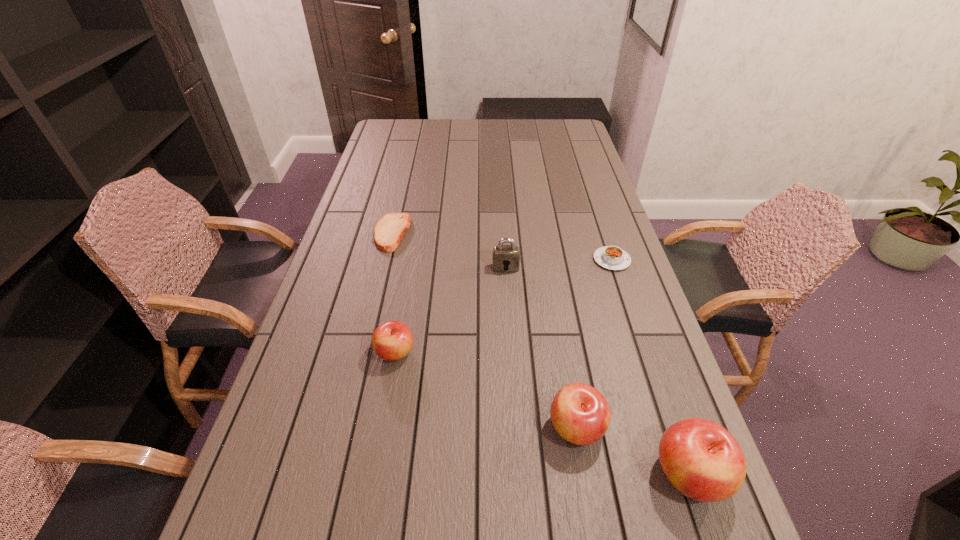
At what (x,y) coordinates should I click in order to perform the action: click on the farthest apple. Please return your answer as a coordinate pair (x, y). Looking at the image, I should click on (393, 340).

Image resolution: width=960 pixels, height=540 pixels. Find the location of `the leftmost apple`. the leftmost apple is located at coordinates (393, 340).

This screenshot has width=960, height=540. I want to click on the second apple from left to right, so click(580, 414).

Where is `the second tallest apple`? This screenshot has height=540, width=960. the second tallest apple is located at coordinates (580, 414).

Where is `the tallest object`? The image size is (960, 540). the tallest object is located at coordinates (701, 459).

Image resolution: width=960 pixels, height=540 pixels. I want to click on the rightmost apple, so 701,459.

Locate an element on the screen. Image resolution: width=960 pixels, height=540 pixels. padlock is located at coordinates (505, 258).

Where is `the second shortest object`? This screenshot has height=540, width=960. the second shortest object is located at coordinates 611,257.

Find the location of a particular element. Image resolution: width=960 pixels, height=540 pixels. pita bread is located at coordinates (390, 230).

In order to click on vacant space located 0.340m on the back of the third shortest object in this screenshot , I will do `click(413, 253)`.